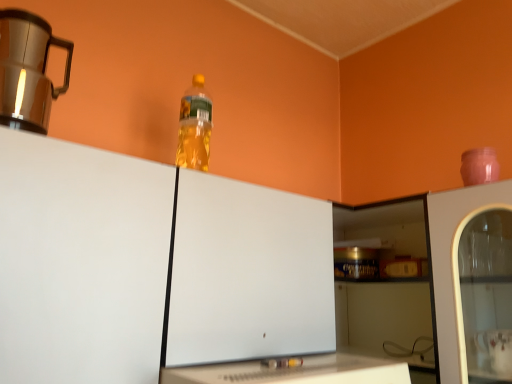
Question: From a real-world perspective, is brushed metal mug at upper left under translucent plastic bottle at upper center?

Choices:
 (A) no
 (B) yes

Answer: (B)

Question: From the image's perspective, is brushed metal mug at upper left over translucent plastic bottle at upper center?

Choices:
 (A) no
 (B) yes

Answer: (B)

Question: Could you tell me if brushed metal mug at upper left is turned towards translucent plastic bottle at upper center?

Choices:
 (A) no
 (B) yes

Answer: (A)

Question: Can you confirm if brushed metal mug at upper left is bigger than translucent plastic bottle at upper center?

Choices:
 (A) no
 (B) yes

Answer: (B)

Question: Does brushed metal mug at upper left come in front of translucent plastic bottle at upper center?

Choices:
 (A) no
 (B) yes

Answer: (B)

Question: From a real-world perspective, is transparent plastic bottle at upper center physically located above or below translucent plastic bottle at upper center?

Choices:
 (A) below
 (B) above

Answer: (A)

Question: Considering their positions, is transparent plastic bottle at upper center located in front of or behind translucent plastic bottle at upper center?

Choices:
 (A) behind
 (B) front

Answer: (B)

Question: Looking at their shapes, would you say transparent plastic bottle at upper center is wider or thinner than translucent plastic bottle at upper center?

Choices:
 (A) thin
 (B) wide

Answer: (B)

Question: From the image's perspective, is transparent plastic bottle at upper center positioned above or below translucent plastic bottle at upper center?

Choices:
 (A) below
 (B) above

Answer: (A)

Question: Considering the positions of white glossy table at lower center and brushed metal mug at upper left in the image, is white glossy table at lower center bigger or smaller than brushed metal mug at upper left?

Choices:
 (A) small
 (B) big

Answer: (B)

Question: Would you say white glossy table at lower center is inside or outside brushed metal mug at upper left?

Choices:
 (A) inside
 (B) outside

Answer: (B)

Question: Considering the positions of point click(x=304, y=355) and point click(x=31, y=102), is point click(x=304, y=355) closer or farther from the camera than point click(x=31, y=102)?

Choices:
 (A) farther
 (B) closer

Answer: (B)

Question: From the image's perspective, is white glossy table at lower center above or below brushed metal mug at upper left?

Choices:
 (A) above
 (B) below

Answer: (B)

Question: Considering the positions of transparent plastic bottle at upper center and brushed metal mug at upper left in the image, is transparent plastic bottle at upper center wider or thinner than brushed metal mug at upper left?

Choices:
 (A) thin
 (B) wide

Answer: (B)

Question: Considering their positions, is transparent plastic bottle at upper center located in front of or behind brushed metal mug at upper left?

Choices:
 (A) front
 (B) behind

Answer: (A)